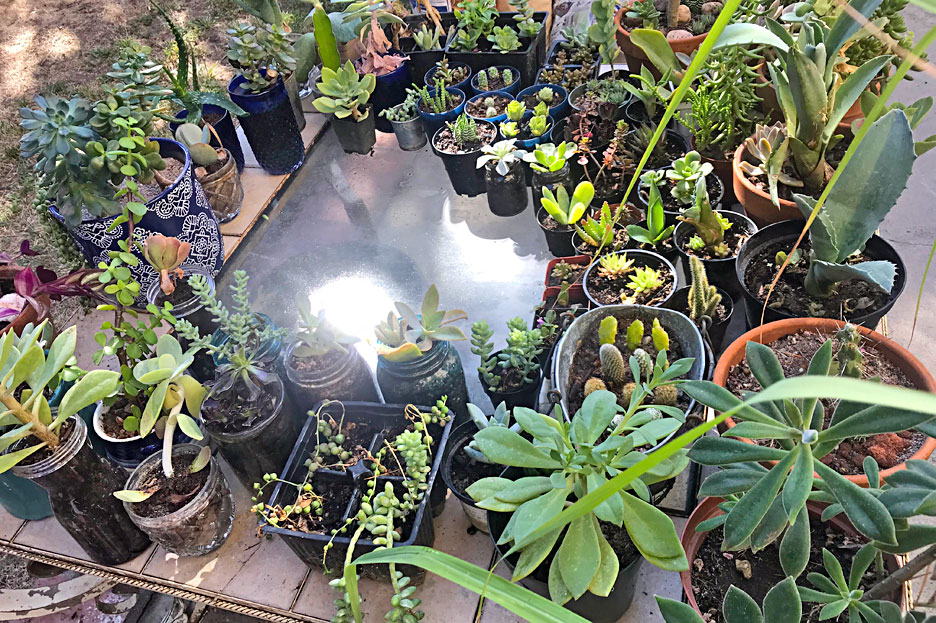
At what (x,y) coordinates should I click in order to perform the action: click on blue decorative pot. Please return your answer as a coordinate pair (x, y). Looking at the image, I should click on (177, 219).